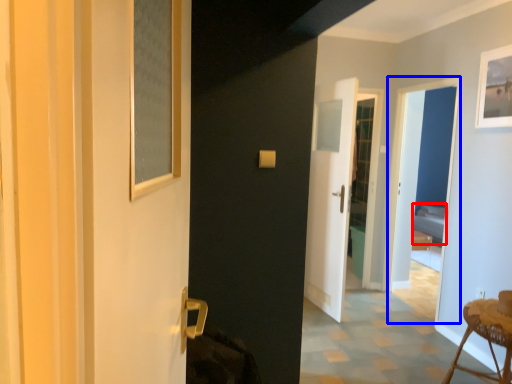
Question: Which of the following is the farthest to the observer, bed (highlighted by a red box) or screen door (highlighted by a blue box)?

Choices:
 (A) bed
 (B) screen door

Answer: (A)